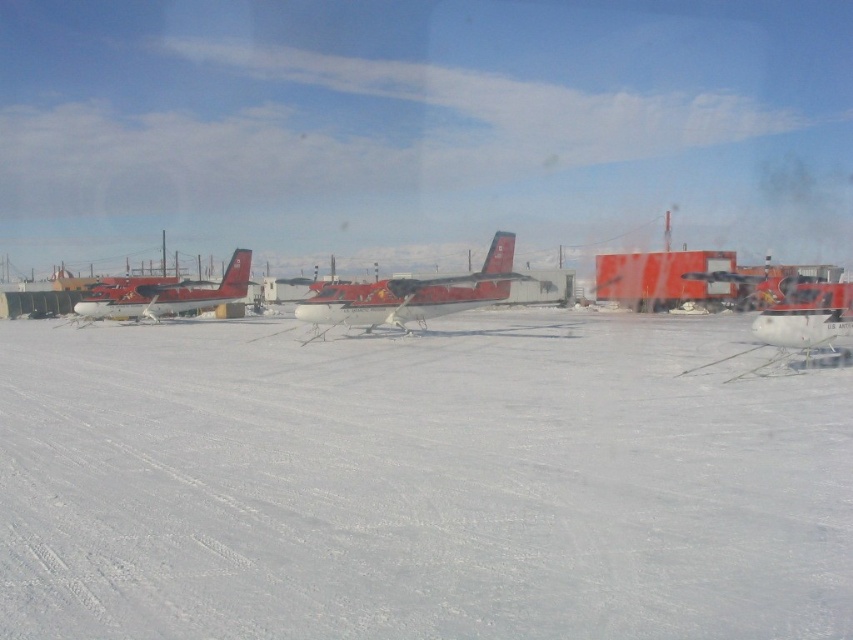
Question: Is white matte snow at center in front of metallic red airplane at center?

Choices:
 (A) no
 (B) yes

Answer: (B)

Question: Among these objects, which one is nearest to the camera?

Choices:
 (A) white matte snow at center
 (B) white matte airplane at right
 (C) metallic red airplane at center

Answer: (A)

Question: Which object is closer to the camera taking this photo?

Choices:
 (A) metallic red airplane at center
 (B) white matte snow at center
 (C) matte red airplane at center
 (D) white matte airplane at right

Answer: (B)

Question: Does metallic red airplane at center appear over white matte airplane at right?

Choices:
 (A) yes
 (B) no

Answer: (A)

Question: Which point is closer to the camera?

Choices:
 (A) matte red airplane at center
 (B) white matte airplane at right
 (C) metallic red airplane at center

Answer: (B)

Question: Can you confirm if white matte snow at center is thinner than metallic red airplane at center?

Choices:
 (A) yes
 (B) no

Answer: (B)